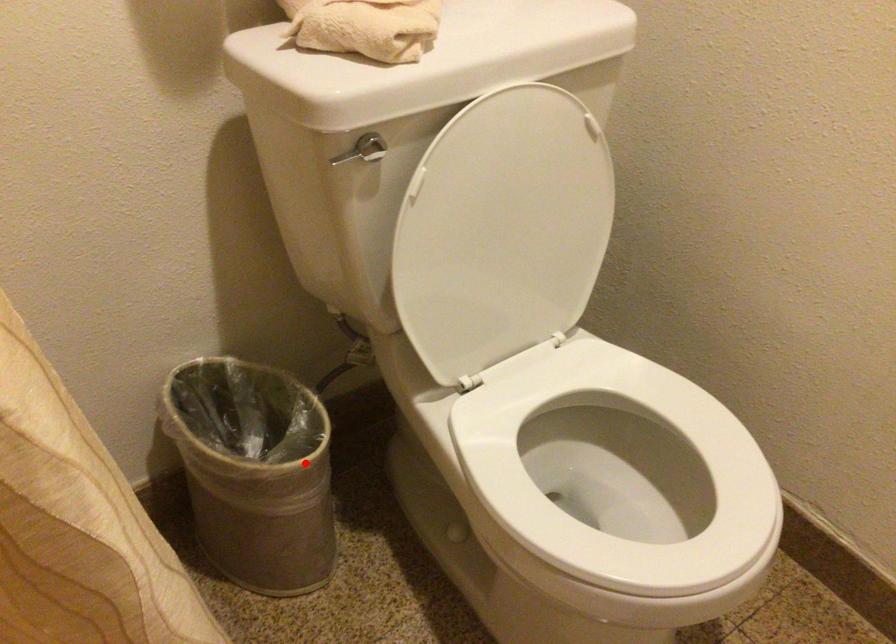
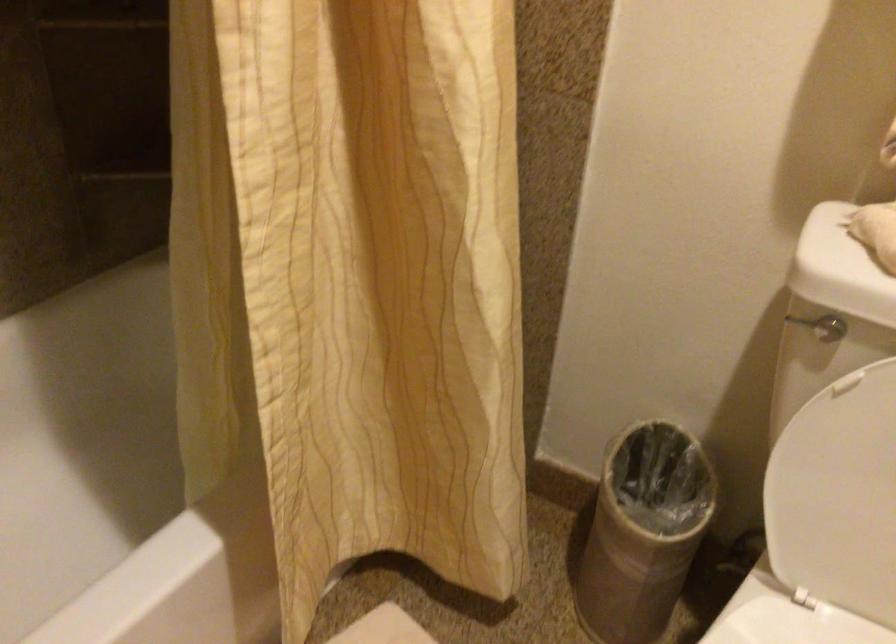
Locate, in the second image, the point that corresponds to the highlighted location in the first image.

(643, 532)